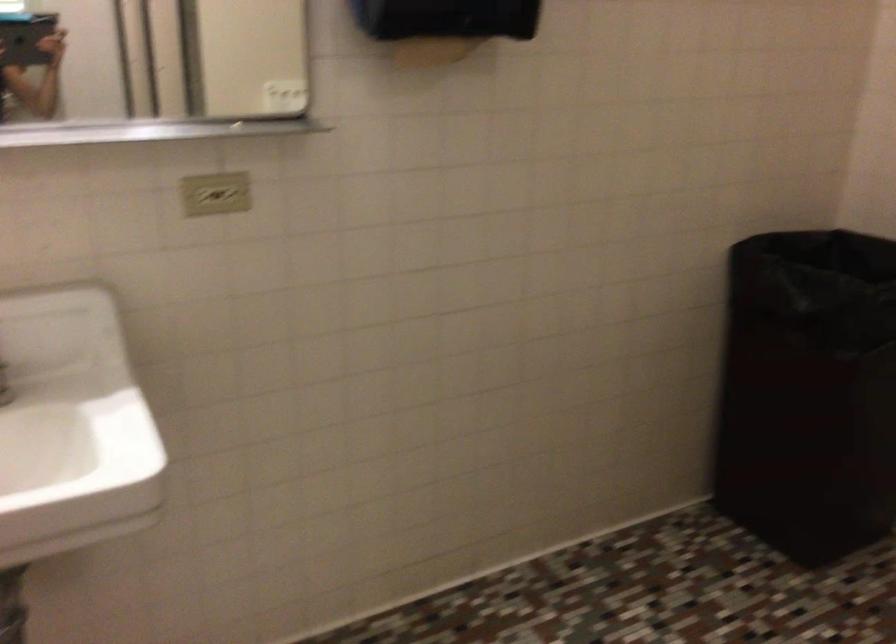
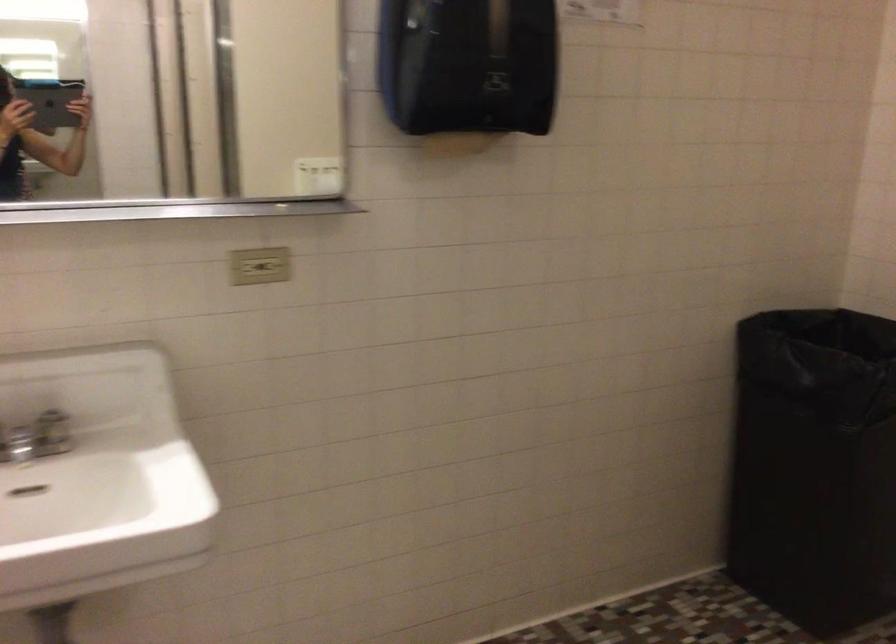
Question: Based on the continuous images, in which direction is the camera rotating? Reply with the corresponding letter.

Choices:
 (A) Left
 (B) Right
 (C) Up
 (D) Down

Answer: (C)